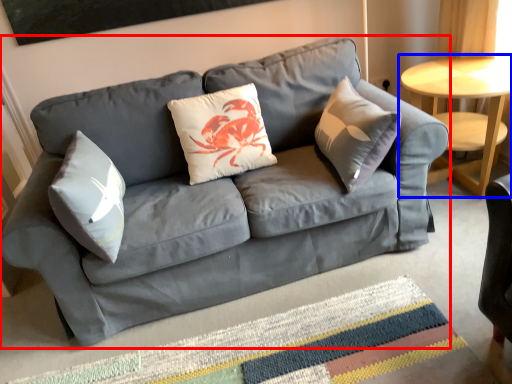
Question: Which object appears closest to the camera in this image, studio couch (highlighted by a red box) or table (highlighted by a blue box)?

Choices:
 (A) studio couch
 (B) table

Answer: (A)